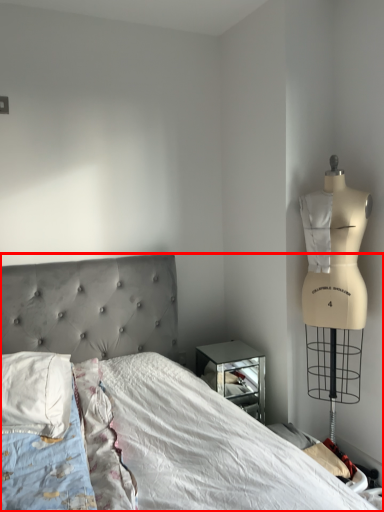
Question: From the image, what is the correct spatial relationship of bed (annotated by the red box) in relation to pillow?

Choices:
 (A) left
 (B) right

Answer: (B)